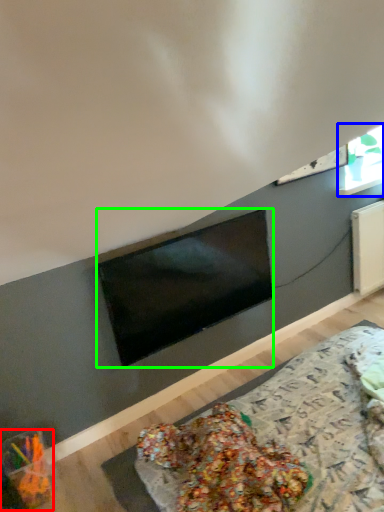
Question: Based on their relative distances, which object is nearer to food (highlighted by a red box)? Choose from window (highlighted by a blue box) and television (highlighted by a green box).

Choices:
 (A) window
 (B) television

Answer: (B)